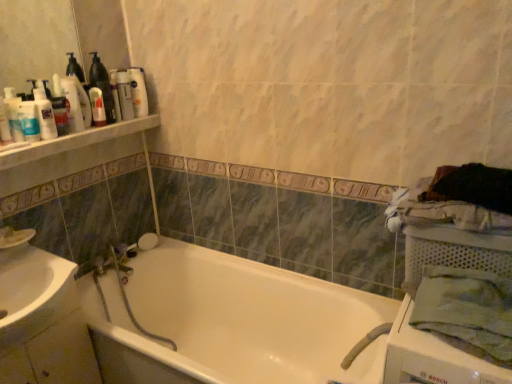
The width and height of the screenshot is (512, 384). What are the coordinates of `vacant space situated above white plastic shelf at upper left (from a real-world perspective)` in the screenshot? It's located at (87, 130).